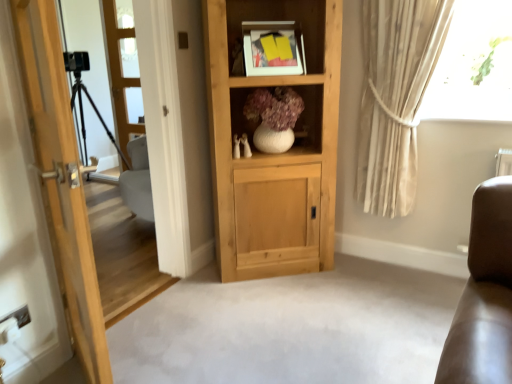
Locate an element on the screen. light wood door at left is located at coordinates (61, 180).

What is the approximate width of clear glass door at left, positioned as the 2th screen door in left-to-right order?

clear glass door at left, positioned as the 2th screen door in left-to-right order, is 2.49 inches wide.

What is the approximate height of white matte vase at center?

37.72 centimeters.

The width and height of the screenshot is (512, 384). Find the location of `matte white picture frame at upper center`. matte white picture frame at upper center is located at coordinates (273, 48).

Find the location of `natural wood cabinet at center`. natural wood cabinet at center is located at coordinates (277, 154).

From the image's perspective, would you say white matte vase at center is positioned over light wood door at left?

Correct, white matte vase at center appears higher than light wood door at left in the image.

Based on the photo, is white matte vase at center surrounding light wood door at left?

No, light wood door at left is not surrounded by white matte vase at center.

Is white matte vase at center looking in the opposite direction of light wood door at left?

That's not correct — white matte vase at center is not looking away from light wood door at left.

This screenshot has height=384, width=512. Identify the location of door located underneath the white matte vase at center (from a real-world perspective). (61, 180).

Considering the sizes of objects matte white picture frame at upper center and clear glass door at left, the 1th screen door when ordered from right to left, in the image provided, who is smaller, matte white picture frame at upper center or clear glass door at left, the 1th screen door when ordered from right to left,?

matte white picture frame at upper center is smaller.

I want to click on the 2nd screen door behind the matte white picture frame at upper center, so click(x=123, y=72).

From a real-world perspective, relative to clear glass door at left, positioned as the 2th screen door in left-to-right order, is matte white picture frame at upper center vertically above or below?

From a real-world perspective, matte white picture frame at upper center is physically above clear glass door at left, positioned as the 2th screen door in left-to-right order.

What's the angular difference between matte white picture frame at upper center and clear glass door at left, the 1th screen door when ordered from right to left,'s facing directions?

The facing directions of matte white picture frame at upper center and clear glass door at left, the 1th screen door when ordered from right to left, are 43.4 degrees apart.

Can you tell me how much white matte vase at center and matte white picture frame at upper center differ in facing direction?

The facing directions of white matte vase at center and matte white picture frame at upper center are 1.06 degrees apart.

Is white matte vase at center in contact with matte white picture frame at upper center?

No, white matte vase at center is not with matte white picture frame at upper center.

Considering the positions of objects white matte vase at center and matte white picture frame at upper center in the image provided, who is more to the right, white matte vase at center or matte white picture frame at upper center?

From the viewer's perspective, white matte vase at center appears more on the right side.

I want to click on shelf in front of the matte white picture frame at upper center, so click(311, 115).

From a real-world perspective, is light wood door at left above or below white matte vase at center?

light wood door at left is below white matte vase at center.

Locate an element on the screen. The height and width of the screenshot is (384, 512). shelf located on the right of light wood door at left is located at coordinates [x=311, y=115].

Is light wood door at left oriented away from white matte vase at center?

Yes, light wood door at left's orientation is away from white matte vase at center.

From the image's perspective, who appears lower, light wood door at left or white matte vase at center?

light wood door at left.

From the image's perspective, is black matte tripod at left, acting as the 2th screen door starting from the right, above or below white matte vase at center?

Clearly, from the image's perspective, black matte tripod at left, acting as the 2th screen door starting from the right, is above white matte vase at center.

Is black matte tripod at left, acting as the 2th screen door starting from the right, with white matte vase at center?

No, black matte tripod at left, acting as the 2th screen door starting from the right, is not touching white matte vase at center.

Is point (106, 268) less distant than point (313, 147)?

No, it is not.

Is light wood door at left not inside natural wood cabinet at center?

Yes, light wood door at left is not within natural wood cabinet at center.

Is light wood door at left thinner than natural wood cabinet at center?

Yes.

Considering the relative sizes of light wood door at left and natural wood cabinet at center in the image provided, is light wood door at left smaller than natural wood cabinet at center?

Correct, light wood door at left occupies less space than natural wood cabinet at center.

Is black matte tripod at left, acting as the 2th screen door starting from the right, at the back of matte white picture frame at upper center?

matte white picture frame at upper center is not turned away from black matte tripod at left, acting as the 2th screen door starting from the right.

Is matte white picture frame at upper center positioned behind black matte tripod at left, acting as the 2th screen door starting from the right?

No, the depth of matte white picture frame at upper center is less than that of black matte tripod at left, acting as the 2th screen door starting from the right.

I want to click on the 2nd screen door to the left of the matte white picture frame at upper center, counting from the anchor's position, so click(x=122, y=252).

Which is nearer, (x=247, y=22) or (x=101, y=217)?

Point (x=247, y=22) appears to be closer to the viewer than point (x=101, y=217).

At what (x,y) coordinates should I click in order to perform the action: click on shelf to the right of light wood door at left. Please return your answer as a coordinate pair (x, y). Looking at the image, I should click on (311, 115).

Find the location of `the 1st screen door above the matte white picture frame at upper center (from the image's perspective)`. the 1st screen door above the matte white picture frame at upper center (from the image's perspective) is located at coordinates (123, 72).

Looking at the image, which one is located further to white matte vase at center, clear glass door at left, positioned as the 2th screen door in left-to-right order, or black matte tripod at left, acting as the 2th screen door starting from the right?

clear glass door at left, positioned as the 2th screen door in left-to-right order, is positioned further to the anchor white matte vase at center.

Which object lies further to the anchor point beige fabric curtain at upper right, natural wood cabinet at center or clear glass door at left, positioned as the 2th screen door in left-to-right order?

clear glass door at left, positioned as the 2th screen door in left-to-right order.

Based on their spatial positions, is beige fabric curtain at upper right or clear glass door at left, the 1th screen door when ordered from right to left, further from natural wood cabinet at center?

clear glass door at left, the 1th screen door when ordered from right to left, is positioned further to the anchor natural wood cabinet at center.

Looking at the image, which one is located closer to clear glass door at left, positioned as the 2th screen door in left-to-right order, black matte tripod at left, which appears as the 1th screen door when viewed from the left, or matte white picture frame at upper center?

Among the two, black matte tripod at left, which appears as the 1th screen door when viewed from the left, is located nearer to clear glass door at left, positioned as the 2th screen door in left-to-right order.

When comparing their distances from white matte vase at center, does light wood door at left or clear glass door at left, the 1th screen door when ordered from right to left, seem further?

Among the two, clear glass door at left, the 1th screen door when ordered from right to left, is located further to white matte vase at center.

From the image, which object appears to be nearer to matte white picture frame at upper center, light wood door at left or clear glass door at left, positioned as the 2th screen door in left-to-right order?

light wood door at left lies closer to matte white picture frame at upper center than the other object.

From the image, which object appears to be farther from natural wood cabinet at center, white matte vase at center or clear glass door at left, positioned as the 2th screen door in left-to-right order?

Based on the image, clear glass door at left, positioned as the 2th screen door in left-to-right order, appears to be further to natural wood cabinet at center.

From the image, which object appears to be nearer to clear glass door at left, positioned as the 2th screen door in left-to-right order, black matte tripod at left, acting as the 2th screen door starting from the right, or white matte vase at center?

black matte tripod at left, acting as the 2th screen door starting from the right.

Identify the location of screen door located between light wood door at left and clear glass door at left, the 1th screen door when ordered from right to left, in the depth direction. The height and width of the screenshot is (384, 512). (122, 252).

The image size is (512, 384). In order to click on screen door between white matte vase at center and clear glass door at left, the 1th screen door when ordered from right to left, in the front-back direction in this screenshot , I will do `click(122, 252)`.

Image resolution: width=512 pixels, height=384 pixels. Find the location of `curtain positioned between light wood door at left and black matte tripod at left, acting as the 2th screen door starting from the right, from near to far`. curtain positioned between light wood door at left and black matte tripod at left, acting as the 2th screen door starting from the right, from near to far is located at coordinates (395, 97).

Find the location of `shelf located between matte white picture frame at upper center and beige fabric curtain at upper right in the left-right direction`. shelf located between matte white picture frame at upper center and beige fabric curtain at upper right in the left-right direction is located at coordinates (311, 115).